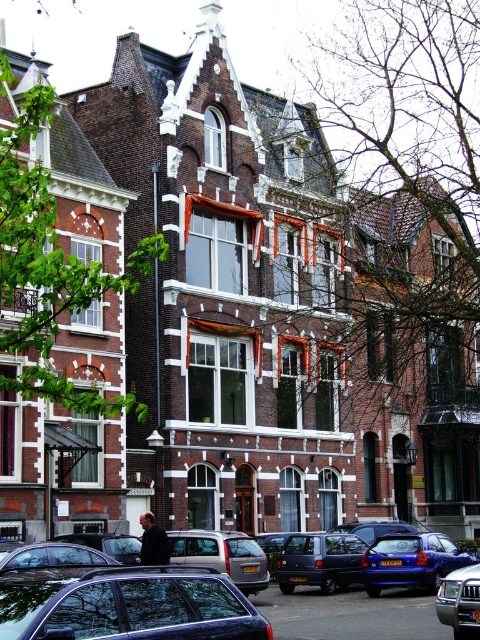
Does point (437, 532) lie in front of point (222, 561)?

No, it is behind (222, 561).

Can you confirm if metallic blue hatchback at center is taller than silver metallic van at center?

Yes, metallic blue hatchback at center is taller than silver metallic van at center.

Does point (396, 570) come in front of point (227, 531)?

Yes, it is.

The height and width of the screenshot is (640, 480). I want to click on metallic blue hatchback at center, so (x=410, y=561).

Which of these two, shiny blue sedan at lower left or silver metallic van at center, stands shorter?

silver metallic van at center

From the picture: Who is positioned more to the right, shiny blue sedan at lower left or silver metallic van at center?

shiny blue sedan at lower left is more to the right.

I want to click on shiny blue sedan at lower left, so click(129, 604).

Measure the distance between matte black car at lower left and silver metallic van at center.

A distance of 26.63 meters exists between matte black car at lower left and silver metallic van at center.

Locate an element on the screen. matte black car at lower left is located at coordinates (128, 605).